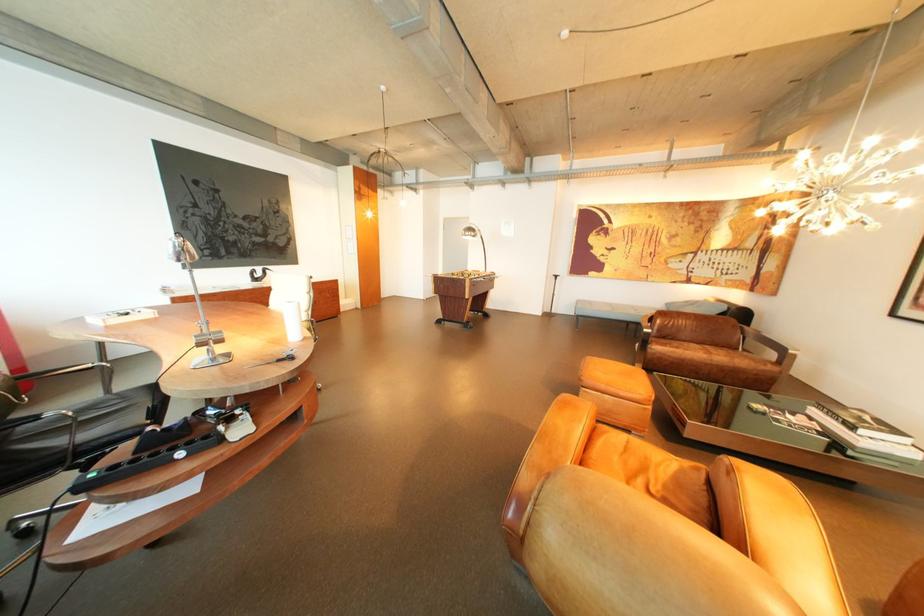
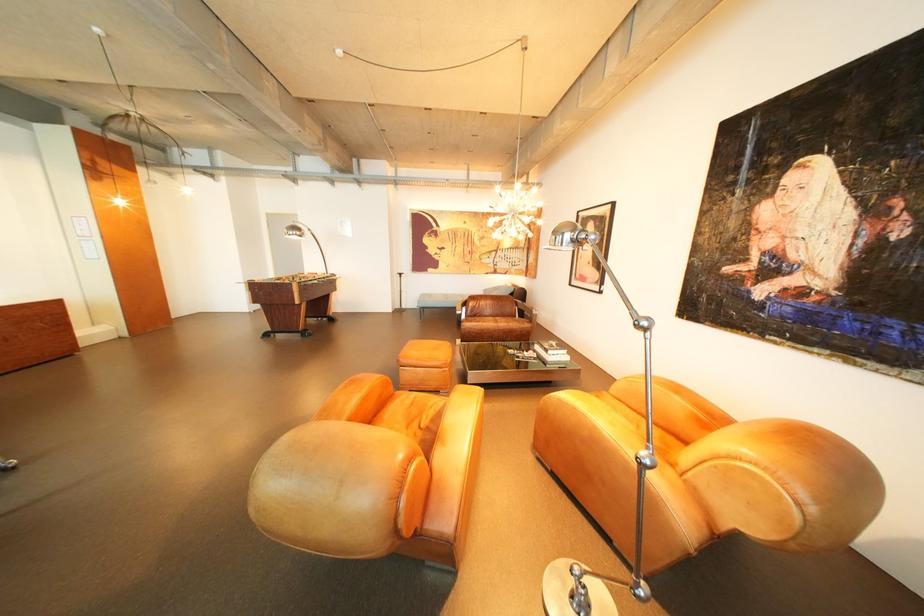
Question: I am providing you with two images of the same scene from different viewpoints. Please identify which objects are invisible in image2.

Choices:
 (A) brown leather chair surface
 (B) orange leather ottoman
 (C) white hardcover book
 (D) none of these

Answer: (D)